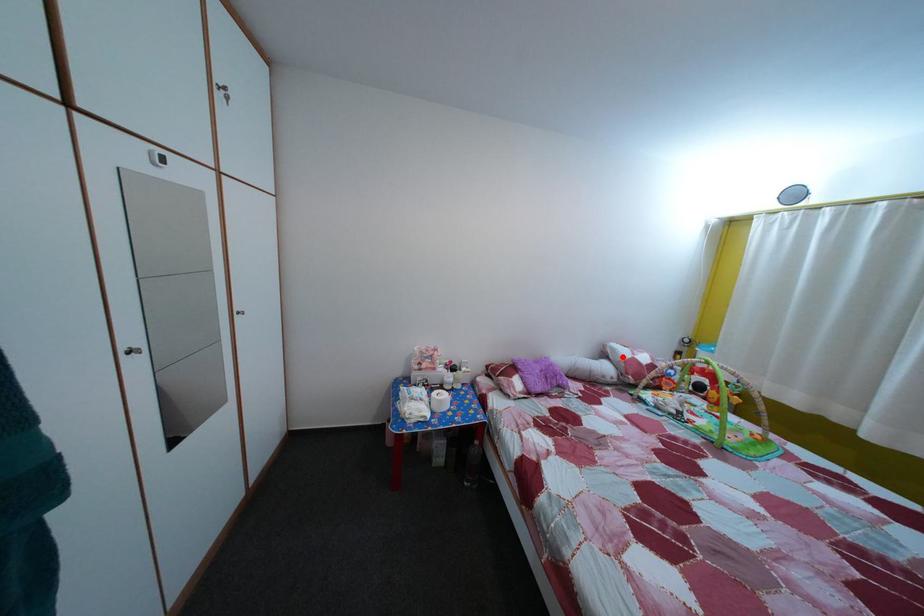
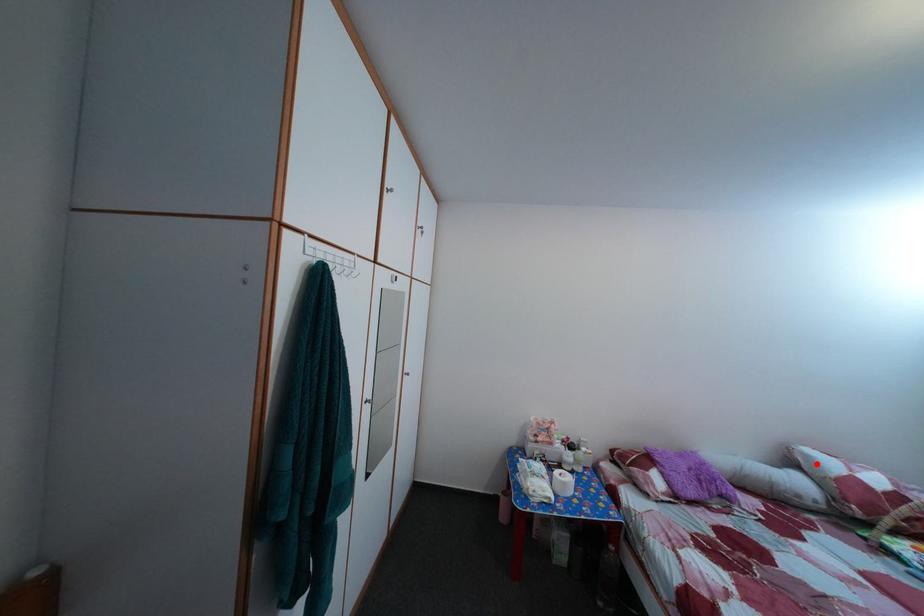
I am providing you with two images of the same scene from different viewpoints. A red point is marked on the first image and another point is marked on the second image. Is the marked point in image1 the same physical position as the marked point in image2?

Yes